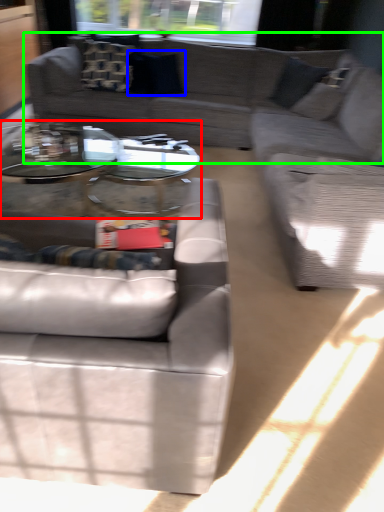
Question: Considering the real-world distances, which object is farthest from coffee table (highlighted by a red box)? pillow (highlighted by a blue box) or studio couch (highlighted by a green box)?

Choices:
 (A) pillow
 (B) studio couch

Answer: (A)